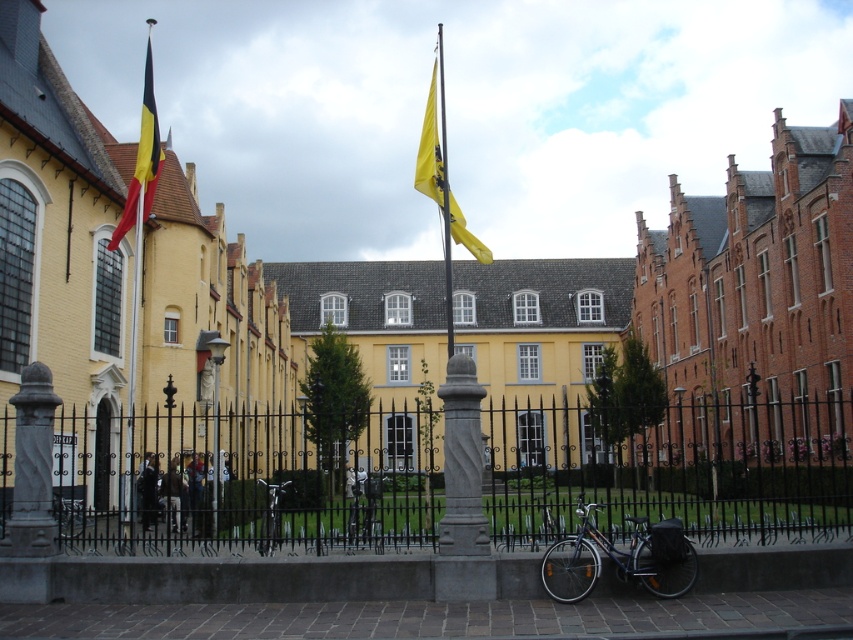
You are standing at the entrance of the historic building complex and want to take a photo of the point at coordinates point (846, 458). Given that your camera has a maximum focus range of 75 meters, will you be able to focus on that point?

The distance of point (846, 458) from camera is 76.84 meters, which exceeds the camera maximum focus range of 75 meters. Therefore, you will not be able to focus on that point.

You are standing in front of the historic building complex and want to park your bicycle. The shiny blue bicycle at lower right is already parked at point (619, 557). Is there space to park another bicycle next to it?

The shiny blue bicycle at lower right is located at point (619, 557). Since the question does not provide information about the availability of space next to this point, it is impossible to determine if there is space to park another bicycle there.

You are a visitor at the historic building complex and want to park your bicycle. You see two bicycles already parked there. Which bicycle, the shiny blue bicycle at lower right or the shiny metallic bicycle at center, is taller and thus might require more vertical space when parking?

The shiny blue bicycle at lower right is taller than the shiny metallic bicycle at center, so it requires more vertical space when parking.